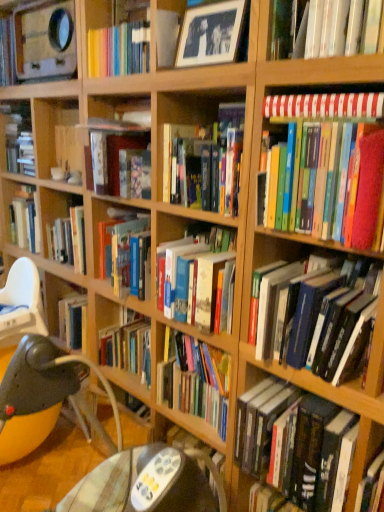
Question: From a real-world perspective, is plastic highchair at lower left positioned over hardcover books at right, which is counted as the sixth book, starting from the top, based on gravity?

Choices:
 (A) yes
 (B) no

Answer: (B)

Question: Is plastic highchair at lower left outside hardcover books at right, which is counted as the sixth book, starting from the top?

Choices:
 (A) yes
 (B) no

Answer: (A)

Question: From the image's perspective, is plastic highchair at lower left beneath hardcover books at right, which is counted as the sixth book, starting from the top?

Choices:
 (A) yes
 (B) no

Answer: (A)

Question: Does plastic highchair at lower left have a larger size compared to hardcover books at right, the second book ordered from the bottom?

Choices:
 (A) yes
 (B) no

Answer: (B)

Question: Considering the relative sizes of plastic highchair at lower left and hardcover books at right, the second book ordered from the bottom, in the image provided, is plastic highchair at lower left taller than hardcover books at right, the second book ordered from the bottom,?

Choices:
 (A) no
 (B) yes

Answer: (A)

Question: Considering the positions of yellow fabric bean bag chair at lower left and hardcover book at upper right, which ranks as the second book in top-to-bottom order, in the image, is yellow fabric bean bag chair at lower left wider or thinner than hardcover book at upper right, which ranks as the second book in top-to-bottom order,?

Choices:
 (A) thin
 (B) wide

Answer: (B)

Question: Considering the positions of point coord(18,440) and point coord(354,7), is point coord(18,440) closer or farther from the camera than point coord(354,7)?

Choices:
 (A) farther
 (B) closer

Answer: (A)

Question: Is yellow fabric bean bag chair at lower left taller or shorter than hardcover book at upper right, which appears as the 6th book when ordered from the bottom?

Choices:
 (A) tall
 (B) short

Answer: (A)

Question: Based on their positions, is yellow fabric bean bag chair at lower left located to the left or right of hardcover book at upper right, which appears as the 6th book when ordered from the bottom?

Choices:
 (A) left
 (B) right

Answer: (A)

Question: Do you think hardcover book at center, arranged as the fourth book when viewed from the top, is within hardcover book at center, which appears as the first book when ordered from the bottom, or outside of it?

Choices:
 (A) outside
 (B) inside

Answer: (A)

Question: Looking at their shapes, would you say hardcover book at center, which is the fourth book in bottom-to-top order, is wider or thinner than hardcover book at center, which appears as the first book when ordered from the bottom?

Choices:
 (A) wide
 (B) thin

Answer: (B)

Question: Considering their positions, is hardcover book at center, arranged as the fourth book when viewed from the top, located in front of or behind hardcover book at center, the 7th book positioned from the top?

Choices:
 (A) front
 (B) behind

Answer: (B)

Question: Is point (208, 148) positioned closer to the camera than point (342, 437)?

Choices:
 (A) farther
 (B) closer

Answer: (A)

Question: Is hardcover books at center inside or outside of hardcover book at center, which appears as the first book when ordered from the bottom?

Choices:
 (A) outside
 (B) inside

Answer: (A)

Question: Visually, is hardcover books at center positioned to the left or to the right of hardcover book at center, which appears as the first book when ordered from the bottom?

Choices:
 (A) right
 (B) left

Answer: (B)